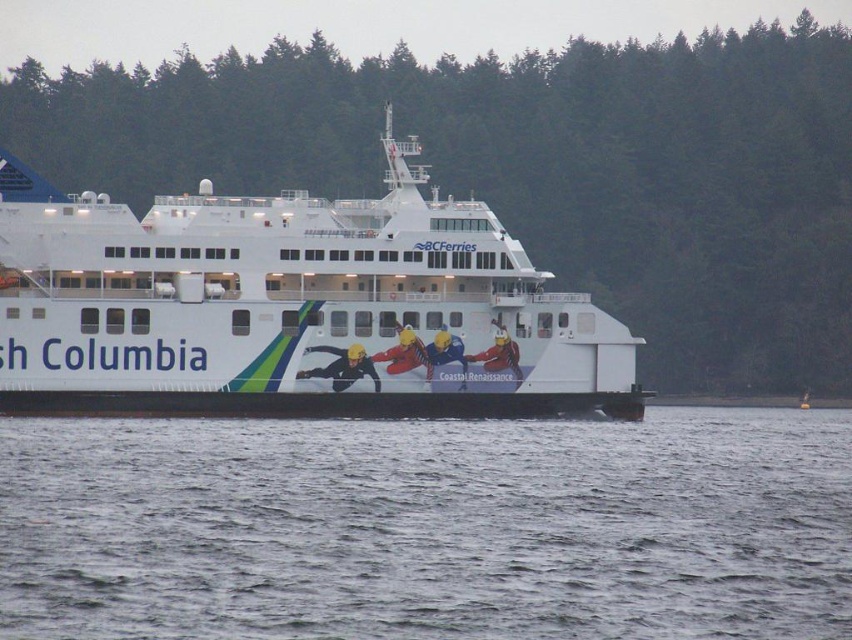
Does gray water at lower center come in front of white matte ferry at center?

That is True.

Can you confirm if gray water at lower center is positioned to the right of white matte ferry at center?

Indeed, gray water at lower center is positioned on the right side of white matte ferry at center.

Where is `gray water at lower center`? The height and width of the screenshot is (640, 852). gray water at lower center is located at coordinates (429, 528).